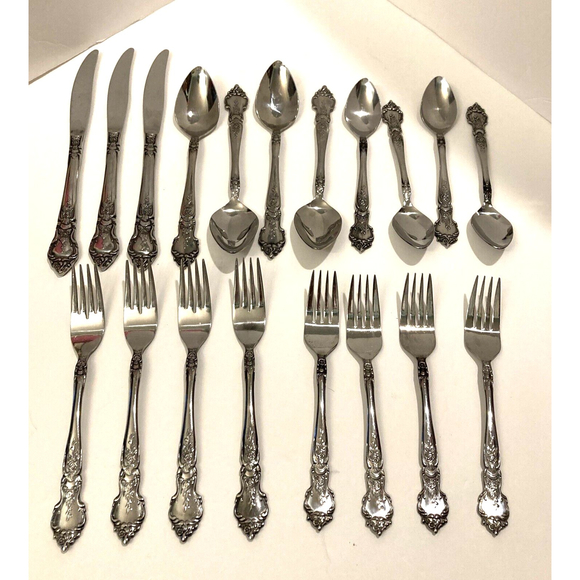
The image size is (580, 580). I want to click on fork, so click(81, 442), click(119, 436), click(174, 432), click(249, 418), click(315, 408), click(366, 398), click(427, 378), click(495, 369).